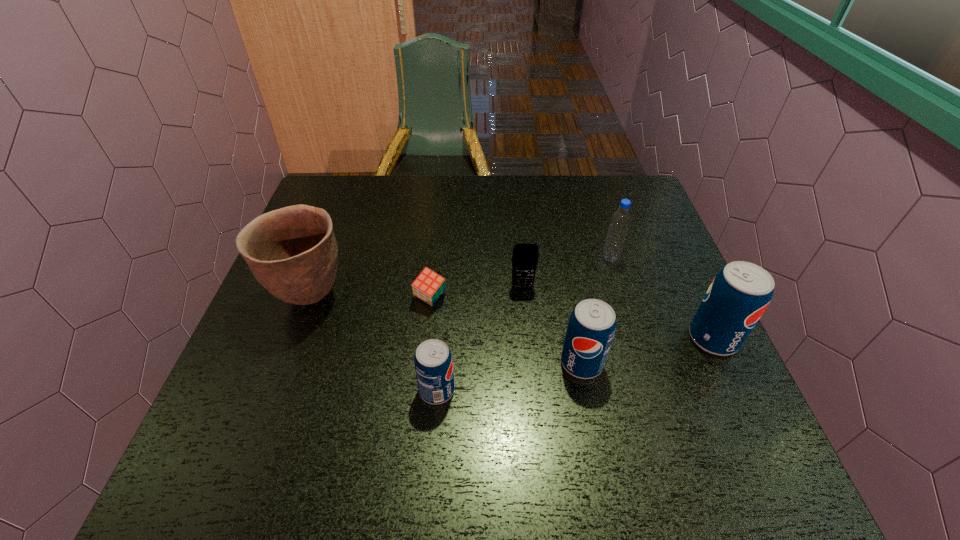
Where is `the leftmost pop`? the leftmost pop is located at coordinates 433,362.

Locate an element on the screen. the second tallest pop is located at coordinates click(591, 328).

The height and width of the screenshot is (540, 960). Identify the location of the second pop from right to left. (591, 328).

Locate an element on the screen. The image size is (960, 540). the rightmost object is located at coordinates (739, 294).

Image resolution: width=960 pixels, height=540 pixels. What are the coordinates of `the rightmost pop` in the screenshot? It's located at (739, 294).

At what (x,y) coordinates should I click in order to perform the action: click on cellular telephone. Please return your answer as a coordinate pair (x, y). Image resolution: width=960 pixels, height=540 pixels. Looking at the image, I should click on (525, 256).

Where is `the leftmost object`? the leftmost object is located at coordinates (292, 252).

Find the location of `cube`. cube is located at coordinates (428, 286).

I want to click on the sixth object from left to right, so click(620, 221).

This screenshot has width=960, height=540. I want to click on the farthest object, so click(620, 221).